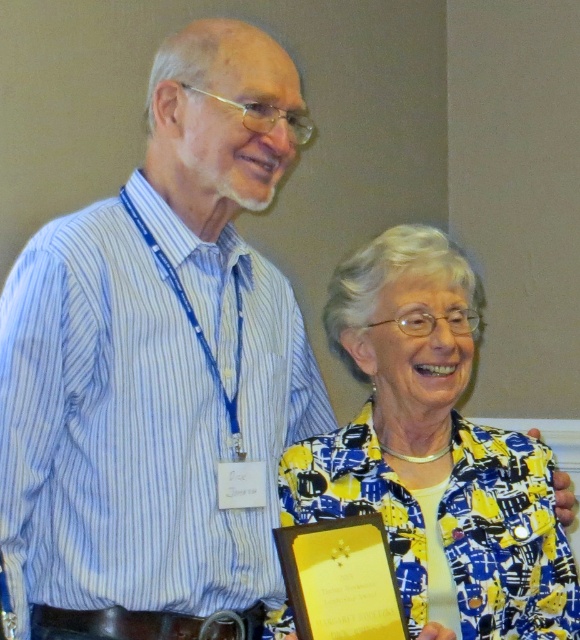
You are organizing a photo shoot and need to arrange two props. The blue striped shirt at center and the yellow printed fabric at center must be placed on a shelf. If the shelf has limited vertical space, which prop should be placed first to ensure both fit?

The yellow printed fabric at center should be placed first since the blue striped shirt at center is taller and requires more vertical space.